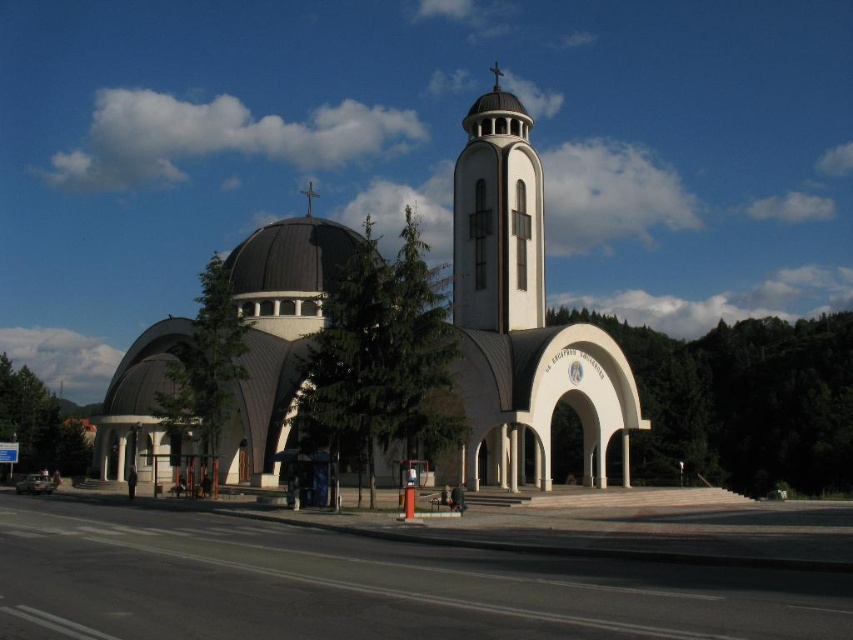
Question: Which object is closer to the camera taking this photo?

Choices:
 (A) white smooth church at center
 (B) white smooth tower at center
 (C) metallic cross at center

Answer: (A)

Question: Can you confirm if white smooth church at center is positioned above white smooth tower at center?

Choices:
 (A) no
 (B) yes

Answer: (A)

Question: Which of the following is the farthest from the observer?

Choices:
 (A) (308, 208)
 (B) (587, 410)
 (C) (525, 321)

Answer: (A)

Question: Does white smooth church at center have a smaller size compared to white smooth tower at center?

Choices:
 (A) yes
 (B) no

Answer: (B)

Question: Does white smooth church at center appear on the left side of white smooth tower at center?

Choices:
 (A) yes
 (B) no

Answer: (A)

Question: Based on their relative distances, which object is nearer to the metallic cross at center?

Choices:
 (A) white smooth tower at center
 (B) white smooth church at center

Answer: (B)